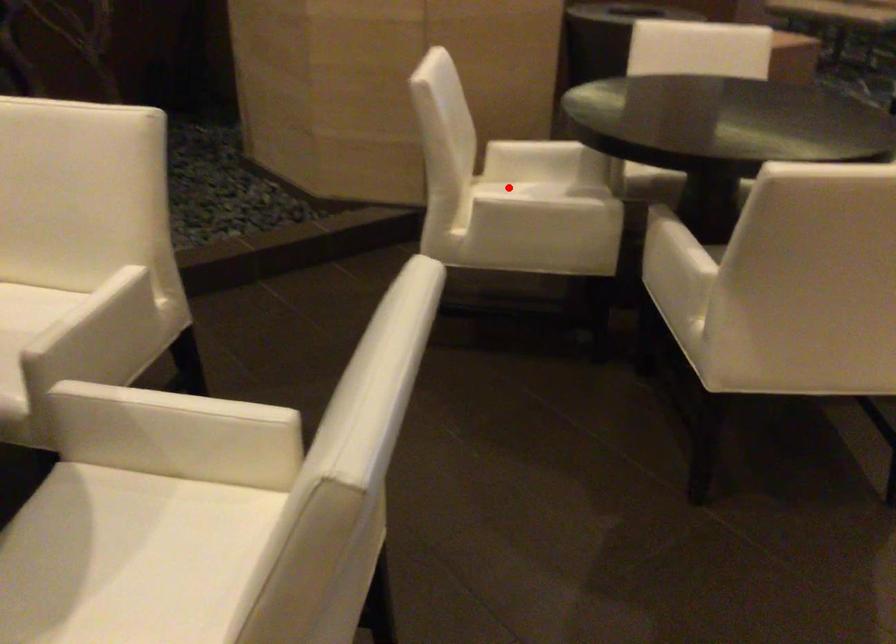
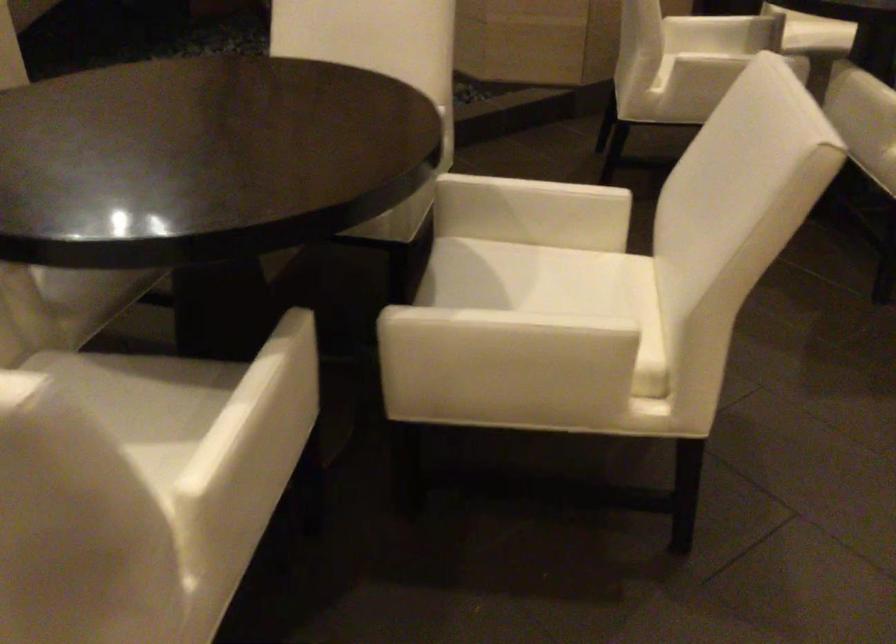
In the second image, find the point that corresponds to the highlighted location in the first image.

(687, 43)